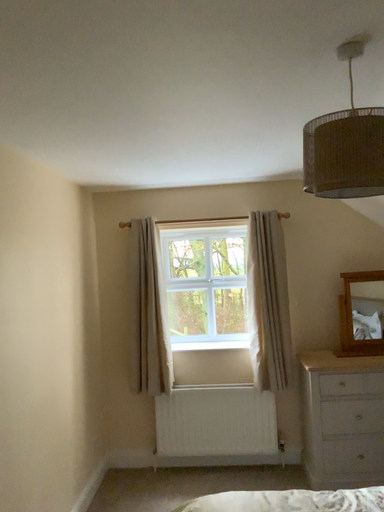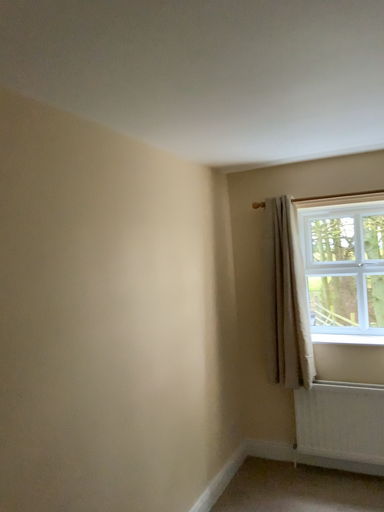
Question: How did the camera likely rotate when shooting the video?

Choices:
 (A) rotated right
 (B) rotated left

Answer: (B)